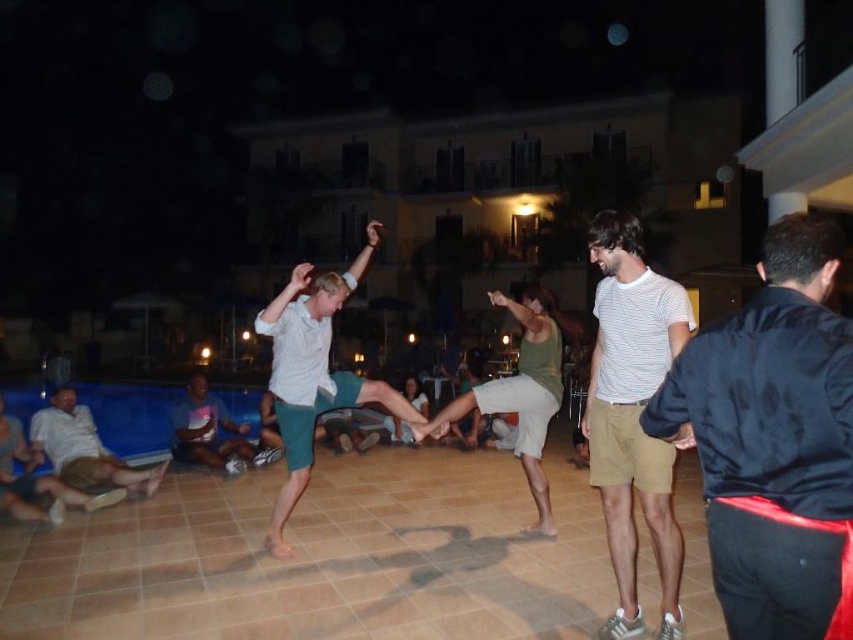
You are standing at the poolside and want to reach both the point at coordinates (675, 572) and the point at coordinates (178, 426). Which point will you reach first if you move straight ahead?

You will reach the point at coordinates (675, 572) first because it is closer to you than the point at coordinates (178, 426).